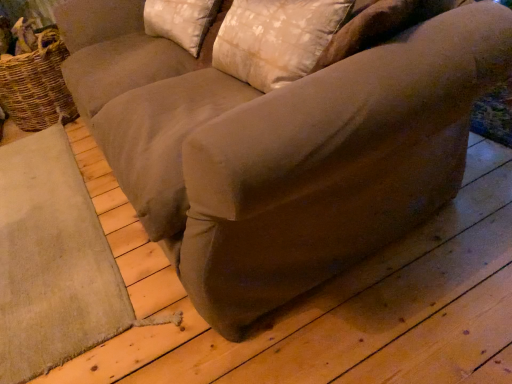
Question: Should I look upward or downward to see beige fabric pillow at upper center, which ranks as the 2th pillow in front-to-back order?

Choices:
 (A) down
 (B) up

Answer: (B)

Question: Could you tell me if satin beige pillow at upper center, arranged as the 2th pillow when viewed from the back, is turned towards beige fabric pillow at upper center, marked as the first pillow in a back-to-front arrangement?

Choices:
 (A) yes
 (B) no

Answer: (B)

Question: Does satin beige pillow at upper center, arranged as the 2th pillow when viewed from the back, lie behind beige fabric pillow at upper center, which ranks as the 2th pillow in front-to-back order?

Choices:
 (A) no
 (B) yes

Answer: (A)

Question: Is the depth of satin beige pillow at upper center, arranged as the 2th pillow when viewed from the back, less than that of beige fabric pillow at upper center, which ranks as the 2th pillow in front-to-back order?

Choices:
 (A) no
 (B) yes

Answer: (B)

Question: Is satin beige pillow at upper center, the 1th pillow viewed from the front, not within beige fabric pillow at upper center, which ranks as the 2th pillow in front-to-back order?

Choices:
 (A) no
 (B) yes

Answer: (B)

Question: Is satin beige pillow at upper center, the 1th pillow viewed from the front, far from beige fabric pillow at upper center, marked as the first pillow in a back-to-front arrangement?

Choices:
 (A) no
 (B) yes

Answer: (A)

Question: From a real-world perspective, does satin beige pillow at upper center, arranged as the 2th pillow when viewed from the back, stand above beige fabric pillow at upper center, which ranks as the 2th pillow in front-to-back order?

Choices:
 (A) no
 (B) yes

Answer: (B)

Question: Considering the relative sizes of beige fabric pillow at upper center, marked as the first pillow in a back-to-front arrangement, and woven brown basket at left in the image provided, is beige fabric pillow at upper center, marked as the first pillow in a back-to-front arrangement, shorter than woven brown basket at left?

Choices:
 (A) no
 (B) yes

Answer: (B)

Question: Is beige fabric pillow at upper center, which ranks as the 2th pillow in front-to-back order, further to camera compared to woven brown basket at left?

Choices:
 (A) yes
 (B) no

Answer: (B)

Question: Would you say woven brown basket at left is part of beige fabric pillow at upper center, which ranks as the 2th pillow in front-to-back order,'s contents?

Choices:
 (A) yes
 (B) no

Answer: (B)

Question: From the image's perspective, is beige fabric pillow at upper center, marked as the first pillow in a back-to-front arrangement, on woven brown basket at left?

Choices:
 (A) yes
 (B) no

Answer: (A)

Question: From a real-world perspective, is beige fabric pillow at upper center, marked as the first pillow in a back-to-front arrangement, located beneath woven brown basket at left?

Choices:
 (A) yes
 (B) no

Answer: (B)

Question: Is beige fabric pillow at upper center, which ranks as the 2th pillow in front-to-back order, not inside woven brown basket at left?

Choices:
 (A) no
 (B) yes

Answer: (B)

Question: From the image's perspective, does woven brown basket at left appear lower than satin beige pillow at upper center, the 1th pillow viewed from the front?

Choices:
 (A) yes
 (B) no

Answer: (B)